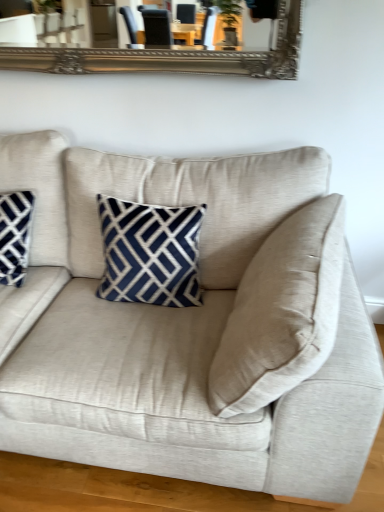
Question: Can you confirm if matte blue and white geometric pillow at left is positioned to the left of beige fabric couch at center?

Choices:
 (A) yes
 (B) no

Answer: (A)

Question: Would you say beige fabric couch at center is part of matte blue and white geometric pillow at left's contents?

Choices:
 (A) no
 (B) yes

Answer: (A)

Question: Does matte blue and white geometric pillow at left appear on the right side of beige fabric couch at center?

Choices:
 (A) yes
 (B) no

Answer: (B)

Question: Is matte blue and white geometric pillow at left positioned beyond the bounds of beige fabric couch at center?

Choices:
 (A) no
 (B) yes

Answer: (A)

Question: Is matte blue and white geometric pillow at left bigger than beige fabric couch at center?

Choices:
 (A) yes
 (B) no

Answer: (B)

Question: Considering the relative sizes of matte blue and white geometric pillow at left and beige fabric couch at center in the image provided, is matte blue and white geometric pillow at left smaller than beige fabric couch at center?

Choices:
 (A) yes
 (B) no

Answer: (A)

Question: From the image's perspective, would you say beige fabric couch at center is shown under matte blue and white geometric pillow at left?

Choices:
 (A) no
 (B) yes

Answer: (B)

Question: Considering the relative sizes of beige fabric couch at center and matte blue and white geometric pillow at left in the image provided, is beige fabric couch at center thinner than matte blue and white geometric pillow at left?

Choices:
 (A) no
 (B) yes

Answer: (A)

Question: Is beige fabric couch at center positioned behind matte blue and white geometric pillow at left?

Choices:
 (A) yes
 (B) no

Answer: (B)

Question: Is beige fabric couch at center shorter than matte blue and white geometric pillow at left?

Choices:
 (A) no
 (B) yes

Answer: (A)

Question: From a real-world perspective, is beige fabric couch at center positioned over matte blue and white geometric pillow at left based on gravity?

Choices:
 (A) no
 (B) yes

Answer: (A)

Question: From the image's perspective, is beige fabric couch at center on top of matte blue and white geometric pillow at left?

Choices:
 (A) yes
 (B) no

Answer: (B)

Question: Visually, is beige fabric couch at center positioned to the left or to the right of matte blue and white geometric pillow at left?

Choices:
 (A) right
 (B) left

Answer: (A)